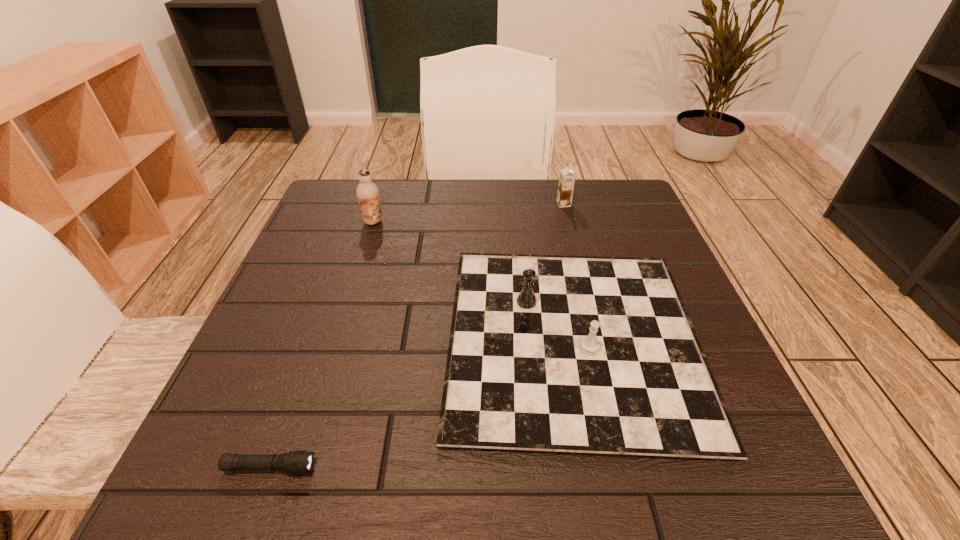
The image size is (960, 540). What are the coordinates of `the third nearest object` in the screenshot? It's located at (367, 192).

You are a GUI agent. You are given a task and a screenshot of the screen. Output one action in this format:
    pyautogui.click(x=<x>, y=<y>)
    Task: Click on the taller chocolate milk
    
    Given the screenshot: What is the action you would take?
    pyautogui.click(x=367, y=192)

This screenshot has width=960, height=540. I want to click on the right chocolate milk, so click(567, 177).

I want to click on the farther chocolate milk, so click(x=567, y=177).

You are a GUI agent. You are given a task and a screenshot of the screen. Output one action in this format:
    pyautogui.click(x=<x>, y=<y>)
    Task: Click on the gameboard
    
    Given the screenshot: What is the action you would take?
    594,355

The image size is (960, 540). Identify the location of flashlight. (296, 462).

This screenshot has height=540, width=960. I want to click on free location located on the right of the second farthest object, so click(471, 222).

Locate an element on the screen. blank space located 0.210m on the left of the right chocolate milk is located at coordinates (473, 204).

You are a GUI agent. You are given a task and a screenshot of the screen. Output one action in this format:
    pyautogui.click(x=<x>, y=<y>)
    Task: Click on the free space located 0.060m on the back of the gameboard
    The image size is (960, 540).
    Given the screenshot: What is the action you would take?
    pyautogui.click(x=553, y=241)

Locate an element on the screen. The image size is (960, 540). free space located 0.390m at the lens end of the shortest object is located at coordinates (594, 467).